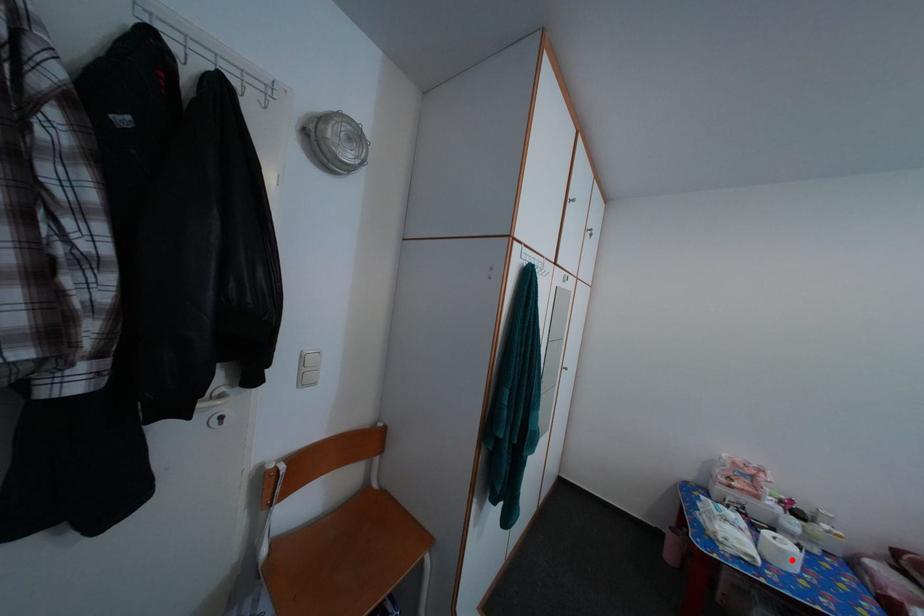
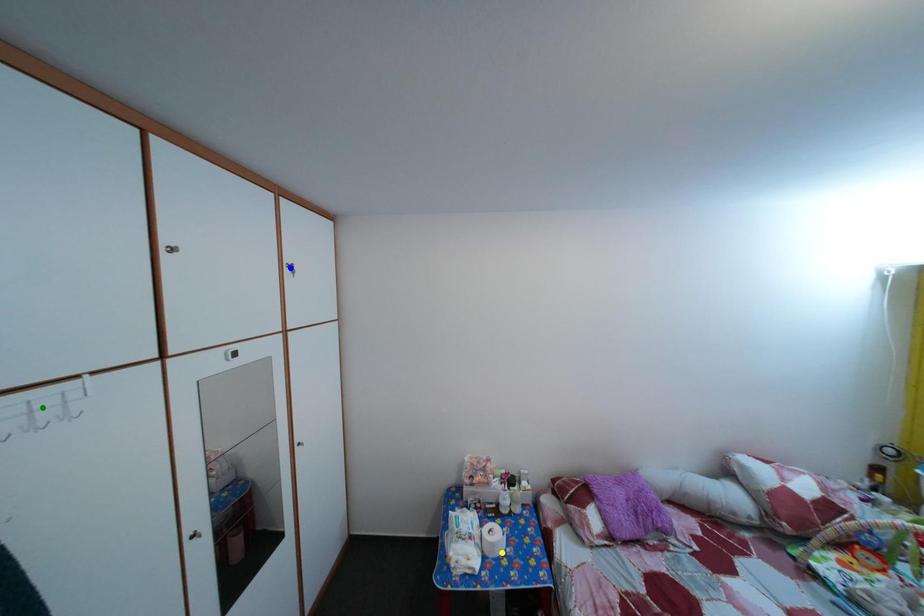
Question: I am providing you with two images of the same scene from different viewpoints. A red point is marked on the first image. You are given multiple points on the second image. Can you choose the point in image 2 that corresponds to the point in image 1?

Choices:
 (A) green point
 (B) blue point
 (C) yellow point

Answer: (C)